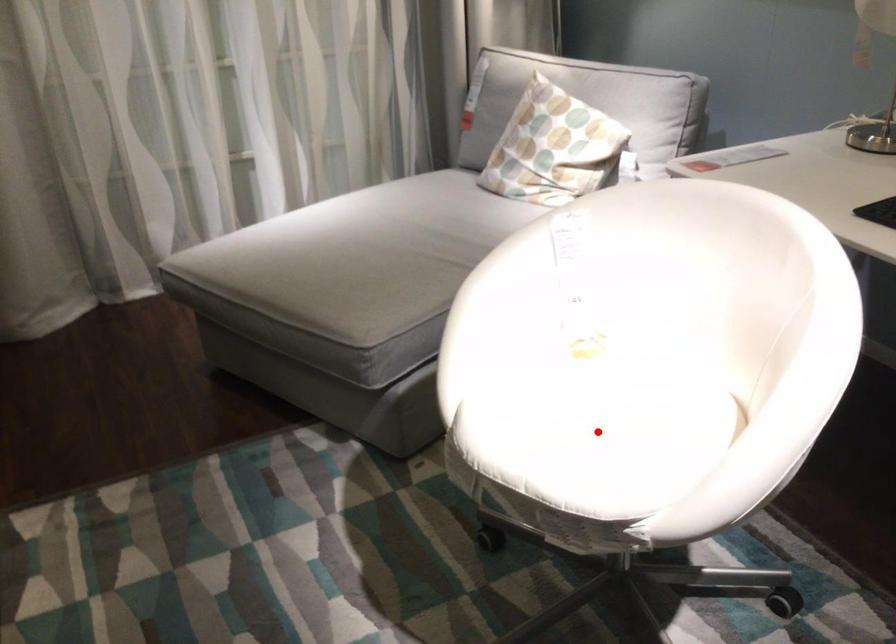
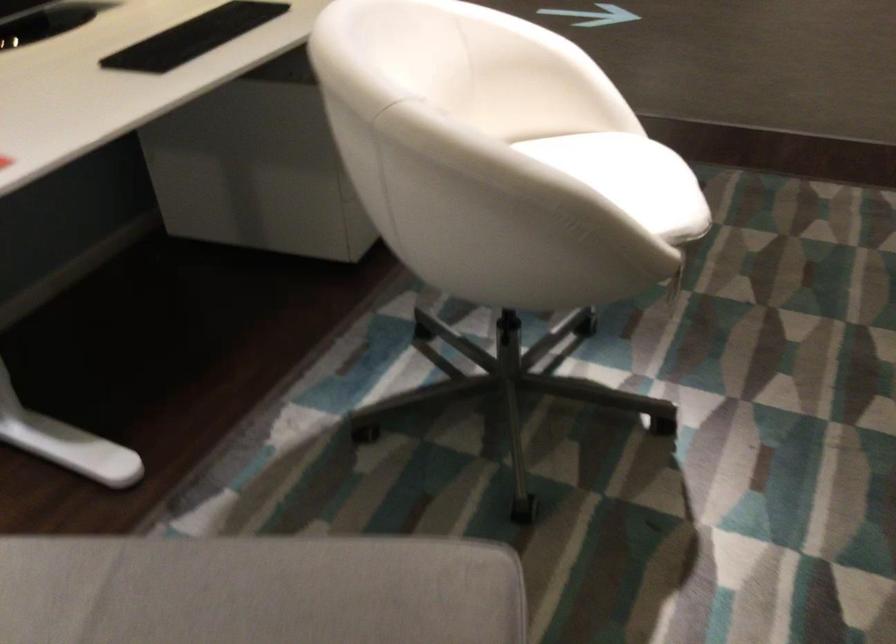
Question: I am providing you with two images of the same scene from different viewpoints. A red point is marked on the first image. At the location where the point appears in image 1, is it still visible in image 2?

Choices:
 (A) Yes
 (B) No

Answer: (B)